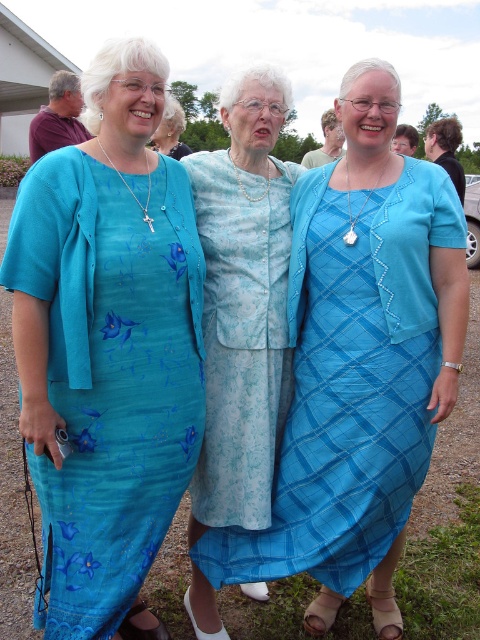
Question: In this image, where is teal floral dress at center located relative to light blue floral dress at center?

Choices:
 (A) right
 (B) left

Answer: (B)

Question: Can you confirm if teal floral dress at center is positioned above matte blue dress at center?

Choices:
 (A) yes
 (B) no

Answer: (B)

Question: Which of the following is the farthest from the observer?

Choices:
 (A) (277, 342)
 (B) (344, 592)

Answer: (A)

Question: Among these objects, which one is farthest from the camera?

Choices:
 (A) matte blue dress at center
 (B) light blue floral dress at center
 (C) teal floral dress at center

Answer: (B)

Question: Based on their relative distances, which object is farther from the matte blue dress at center?

Choices:
 (A) teal floral dress at center
 (B) light blue floral dress at center

Answer: (A)

Question: Can you confirm if teal floral dress at center is thinner than light blue floral dress at center?

Choices:
 (A) no
 (B) yes

Answer: (A)